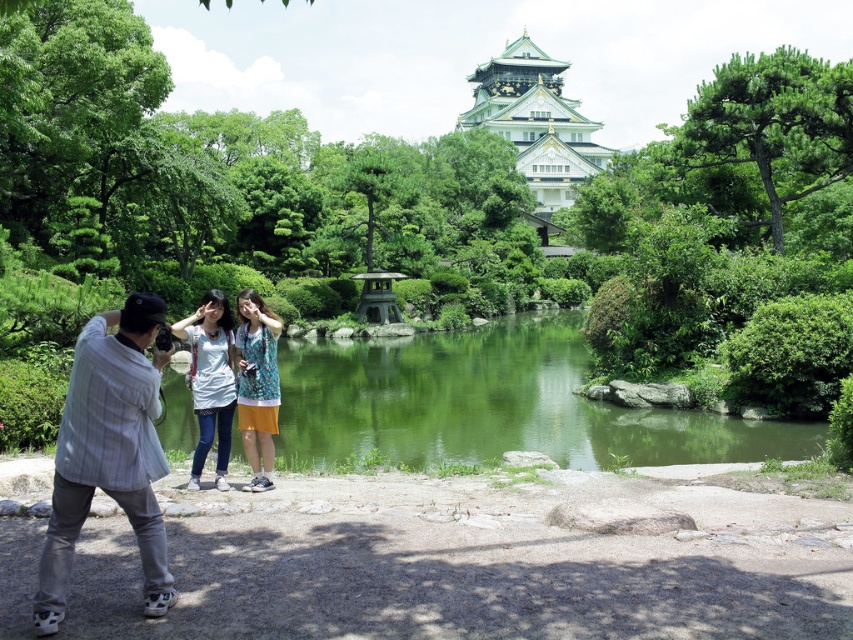
Between white cotton shirt at center and printed cotton dress at center, which one has more height?

white cotton shirt at center is taller.

Locate an element on the screen. white cotton shirt at center is located at coordinates (210, 380).

The width and height of the screenshot is (853, 640). In order to click on white cotton shirt at center in this screenshot , I will do `click(210, 380)`.

Does point (148, 554) come behind point (265, 403)?

No, it is in front of (265, 403).

Is gray striped shirt at left wider than printed cotton dress at center?

Indeed, gray striped shirt at left has a greater width compared to printed cotton dress at center.

Is point (53, 518) positioned before point (239, 385)?

Yes, point (53, 518) is closer to viewer.

This screenshot has height=640, width=853. Find the location of `gray striped shirt at left`. gray striped shirt at left is located at coordinates (109, 452).

Is gray striped shirt at left taller than white glossy pagoda at upper center?

Incorrect, gray striped shirt at left's height is not larger of white glossy pagoda at upper center's.

Does point (102, 326) lie in front of point (527, 88)?

Yes, it is.

Find the location of a particular element. Image resolution: width=853 pixels, height=640 pixels. gray striped shirt at left is located at coordinates (109, 452).